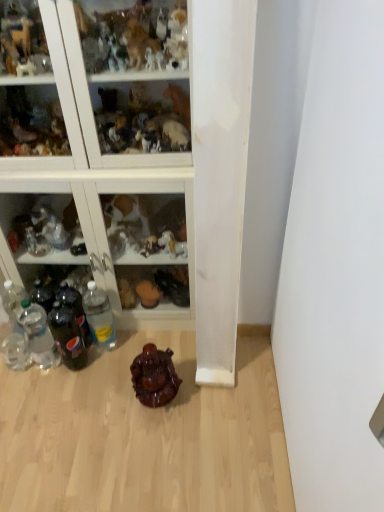
Where is `free location in front of dark glass bottle at lower left, which is the 4th bottle in left-to-right order`? The image size is (384, 512). free location in front of dark glass bottle at lower left, which is the 4th bottle in left-to-right order is located at coordinates tap(75, 398).